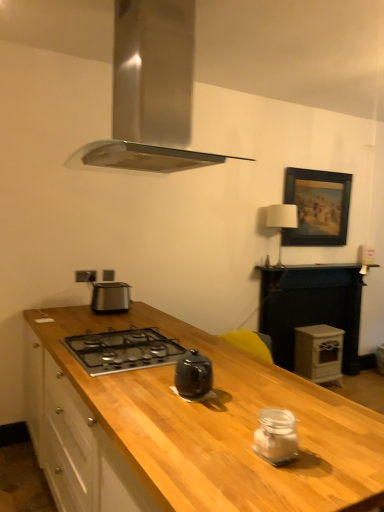
At what (x,y) coordinates should I click in order to perform the action: click on free region on the left part of clear glass jar at center, which is counted as the second kitchen appliance, starting from the left. Please return your answer as a coordinate pair (x, y). Looking at the image, I should click on (219, 453).